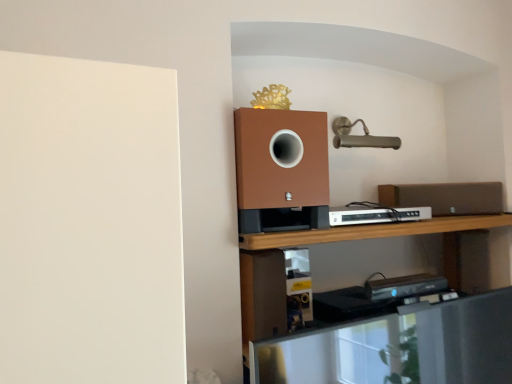
Question: Considering the relative sizes of white plastic dvd player at center and brown matte speaker at right in the image provided, is white plastic dvd player at center smaller than brown matte speaker at right?

Choices:
 (A) no
 (B) yes

Answer: (B)

Question: Is white plastic dvd player at center turned away from brown matte speaker at right?

Choices:
 (A) no
 (B) yes

Answer: (A)

Question: From the image's perspective, is white plastic dvd player at center on top of brown matte speaker at right?

Choices:
 (A) no
 (B) yes

Answer: (A)

Question: Is brown matte speaker at right surrounded by white plastic dvd player at center?

Choices:
 (A) no
 (B) yes

Answer: (A)

Question: Is white plastic dvd player at center not near brown matte speaker at right?

Choices:
 (A) no
 (B) yes

Answer: (A)

Question: From a real-world perspective, is white plastic dvd player at center physically below brown matte speaker at right?

Choices:
 (A) no
 (B) yes

Answer: (B)

Question: Can you confirm if metallic silver shelf at lower center is taller than white plastic dvd player at center?

Choices:
 (A) yes
 (B) no

Answer: (A)

Question: Does metallic silver shelf at lower center lie behind white plastic dvd player at center?

Choices:
 (A) no
 (B) yes

Answer: (A)

Question: Is the depth of metallic silver shelf at lower center less than that of white plastic dvd player at center?

Choices:
 (A) no
 (B) yes

Answer: (B)

Question: From the image's perspective, is metallic silver shelf at lower center beneath white plastic dvd player at center?

Choices:
 (A) yes
 (B) no

Answer: (A)

Question: From a real-world perspective, is metallic silver shelf at lower center beneath white plastic dvd player at center?

Choices:
 (A) yes
 (B) no

Answer: (A)

Question: Can you confirm if metallic silver shelf at lower center is smaller than white plastic dvd player at center?

Choices:
 (A) yes
 (B) no

Answer: (B)

Question: Are metallic silver shelf at lower center and brown matte speaker at right making contact?

Choices:
 (A) no
 (B) yes

Answer: (A)